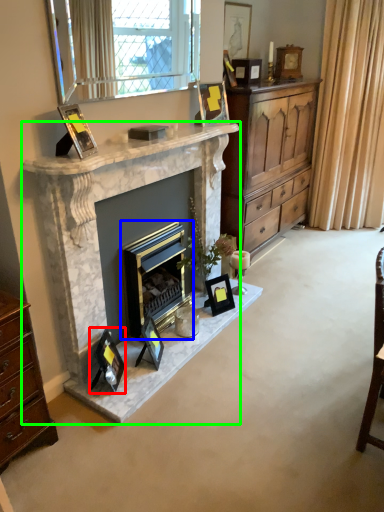
Question: Estimate the real-world distances between objects in this image. Which object is farther from picture frame (highlighted by a red box), fireplace (highlighted by a blue box) or fireplace (highlighted by a green box)?

Choices:
 (A) fireplace
 (B) fireplace

Answer: (B)